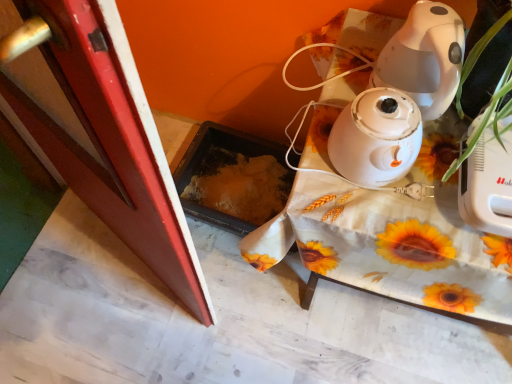
Find the location of a particular element. This screenshot has width=512, height=384. free space to the left of white fabric-covered table at upper right is located at coordinates (202, 269).